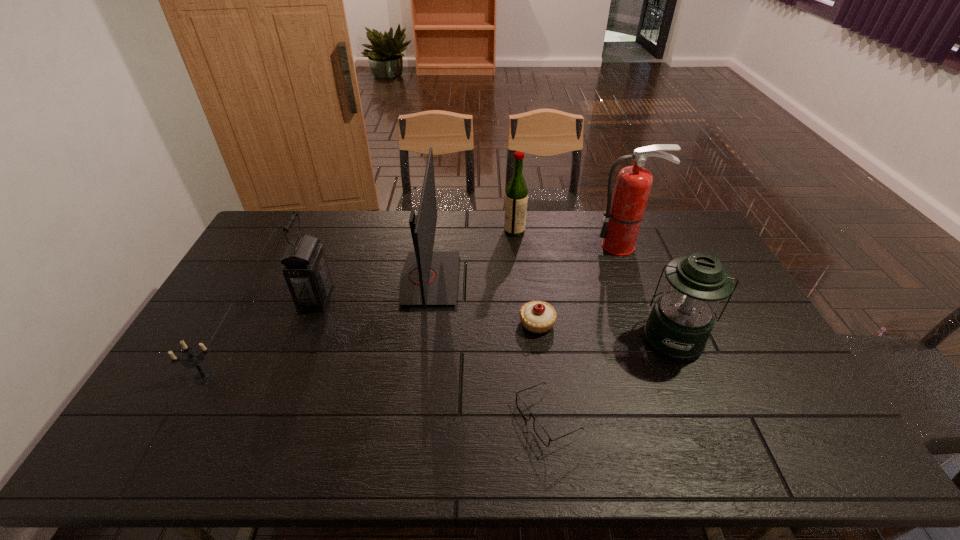
Where is `fire extinguisher`? fire extinguisher is located at coordinates (623, 216).

You are a GUI agent. You are given a task and a screenshot of the screen. Output one action in this format:
    pyautogui.click(x=<x>, y=<y>)
    Task: Click on the monitor
    The width and height of the screenshot is (960, 540).
    Given the screenshot: What is the action you would take?
    pyautogui.click(x=429, y=277)

Identify the location of liquor. The image size is (960, 540). (516, 196).

Identify the location of the farther lantern. (305, 269).

Locate an element on the screen. The width and height of the screenshot is (960, 540). the left lantern is located at coordinates (305, 269).

At what (x,y) coordinates should I click in order to perform the action: click on the nearer lantern. Please return your answer as a coordinate pair (x, y). The image size is (960, 540). Looking at the image, I should click on (680, 323).

Where is `the second nearest object`? The width and height of the screenshot is (960, 540). the second nearest object is located at coordinates pos(194,358).

This screenshot has height=540, width=960. I want to click on the leftmost object, so click(194, 358).

You are a GUI agent. You are given a task and a screenshot of the screen. Output one action in this format:
    pyautogui.click(x=<x>, y=<y>)
    Task: Click on the second shortest object
    
    Given the screenshot: What is the action you would take?
    pyautogui.click(x=536, y=316)

Where is `the nearest object`? This screenshot has height=540, width=960. the nearest object is located at coordinates (542, 434).